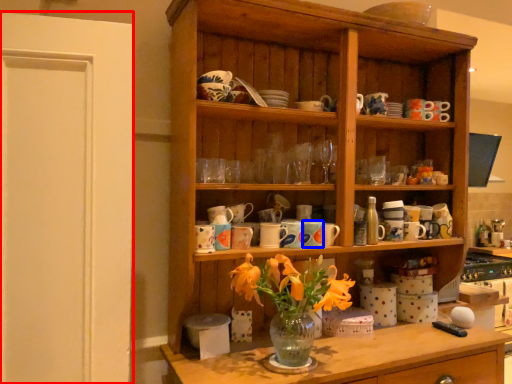
Question: Which object is further to the camera taking this photo, glass door (highlighted by a red box) or tableware (highlighted by a blue box)?

Choices:
 (A) glass door
 (B) tableware

Answer: (B)